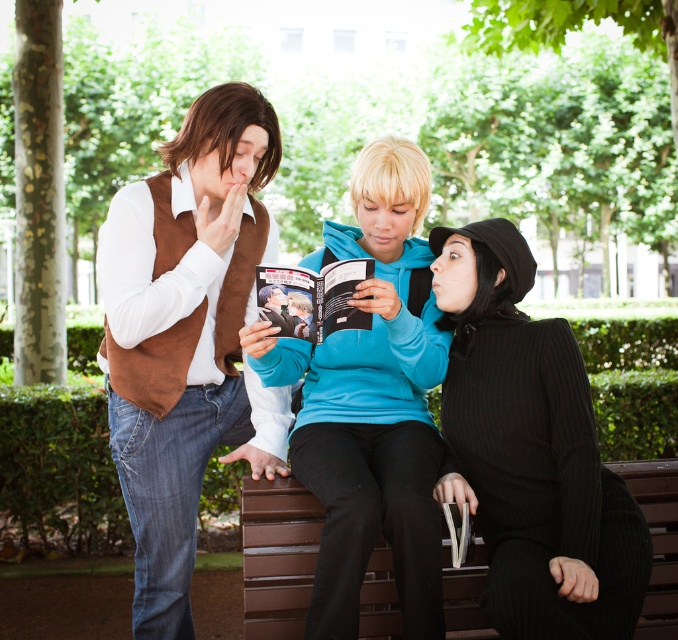
You are a photographer trying to capture a photo of the blue fleece jacket at center and the brown wooden bench at lower center. Which object is taller in the scene?

The blue fleece jacket at center is taller than the brown wooden bench at lower center.

In the scene shown: Based on the coordinates provided, which object in the scene is located at point (186, 337)?

The point (186, 337) corresponds to the suede brown vest at left.

You are a delivery robot with a package that needs to be placed between the blue fleece jacket at center and the matte brown vest at center. The package is 15 inches long. Will it fit in the space between them?

The distance between the blue fleece jacket at center and the matte brown vest at center is 16.40 inches. Since the package is 15 inches long, it will fit in the space between them.